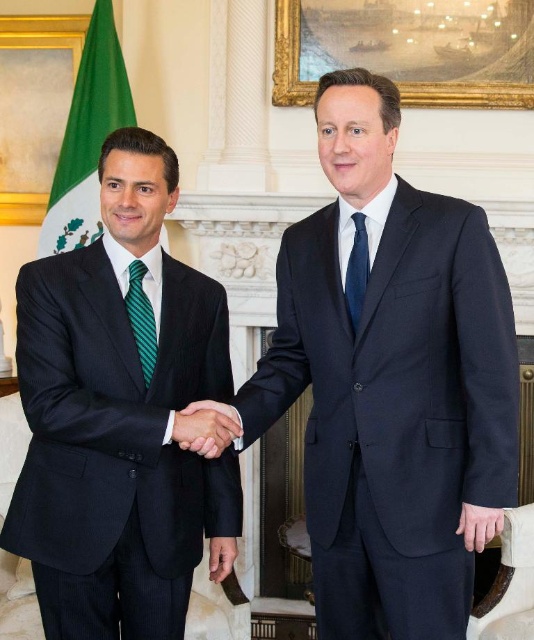
Can you confirm if matte black suit at left is thinner than matte black hands at center?

In fact, matte black suit at left might be wider than matte black hands at center.

Is point (127, 461) in front of point (218, 444)?

No, (127, 461) is further to viewer.

What do you see at coordinates (120, 419) in the screenshot? I see `matte black suit at left` at bounding box center [120, 419].

At what (x,y) coordinates should I click in order to perform the action: click on matte black suit at left. Please return your answer as a coordinate pair (x, y). Looking at the image, I should click on (120, 419).

Is matte black suit at left smaller than green striped tie at left?

No, matte black suit at left is not smaller than green striped tie at left.

Between point (146, 284) and point (139, 301), which one is positioned in front?

Point (139, 301) is in front.

Locate an element on the screen. Image resolution: width=534 pixels, height=640 pixels. matte black suit at left is located at coordinates (120, 419).

Is navy blue suit at center to the right of navy silk tie at center from the viewer's perspective?

Yes, navy blue suit at center is to the right of navy silk tie at center.

Is point (349, 406) less distant than point (362, 257)?

Yes, point (349, 406) is in front of point (362, 257).

Locate an element on the screen. The width and height of the screenshot is (534, 640). navy blue suit at center is located at coordinates tap(391, 381).